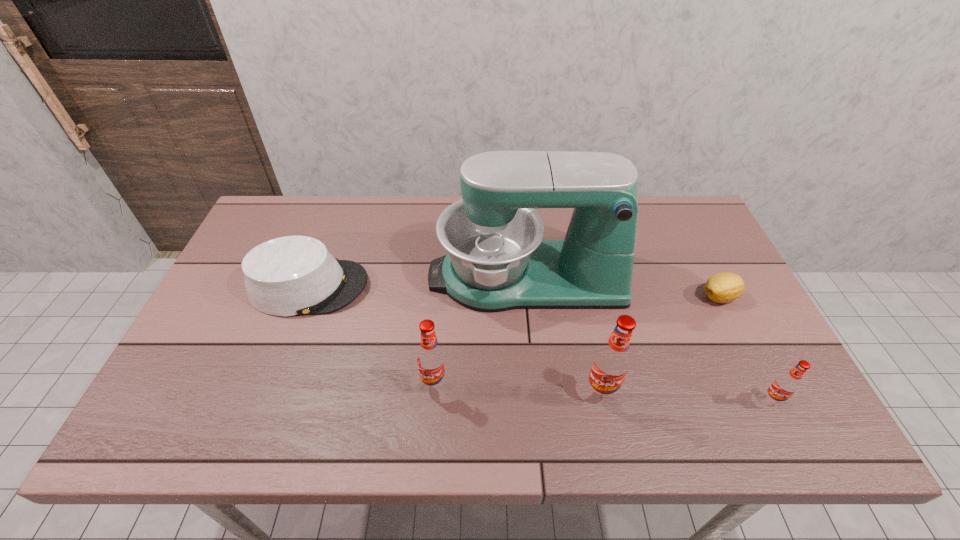
Locate an element on the screen. The width and height of the screenshot is (960, 540). root beer object that ranks as the closest to the leftmost object is located at coordinates (431, 360).

This screenshot has width=960, height=540. Find the location of `free spot that satisfies the following two spatial constraints: 1. on the front-facing side of the fifth tallest object; 2. on the right side of the leftmost root beer`. free spot that satisfies the following two spatial constraints: 1. on the front-facing side of the fifth tallest object; 2. on the right side of the leftmost root beer is located at coordinates coord(274,384).

Where is `vacant space that satisfies the following two spatial constraints: 1. at the stem end of the shortest object; 2. on the back side of the rightmost root beer`? The height and width of the screenshot is (540, 960). vacant space that satisfies the following two spatial constraints: 1. at the stem end of the shortest object; 2. on the back side of the rightmost root beer is located at coordinates click(772, 401).

At what (x,y) coordinates should I click in order to perform the action: click on vacant space that satisfies the following two spatial constraints: 1. on the front-facing side of the tallest object; 2. on the right side of the second root beer from right to left. Please return your answer as a coordinate pair (x, y). This screenshot has width=960, height=540. Looking at the image, I should click on (538, 393).

At what (x,y) coordinates should I click in order to perform the action: click on free location that satisfies the following two spatial constraints: 1. on the back side of the second root beer from right to left; 2. on the front-facing side of the fifth tallest object. Please return your answer as a coordinate pair (x, y). This screenshot has height=540, width=960. Looking at the image, I should click on (579, 287).

At what (x,y) coordinates should I click in order to perform the action: click on vacant region that satisfies the following two spatial constraints: 1. on the front-facing side of the second root beer from left to right; 2. on the left side of the fifth tallest object. Please return your answer as a coordinate pair (x, y). This screenshot has width=960, height=540. Looking at the image, I should click on (271, 393).

The image size is (960, 540). In order to click on blank area in the image that satisfies the following two spatial constraints: 1. on the front side of the leftmost root beer; 2. on the right side of the third shortest object in this screenshot , I will do `click(433, 401)`.